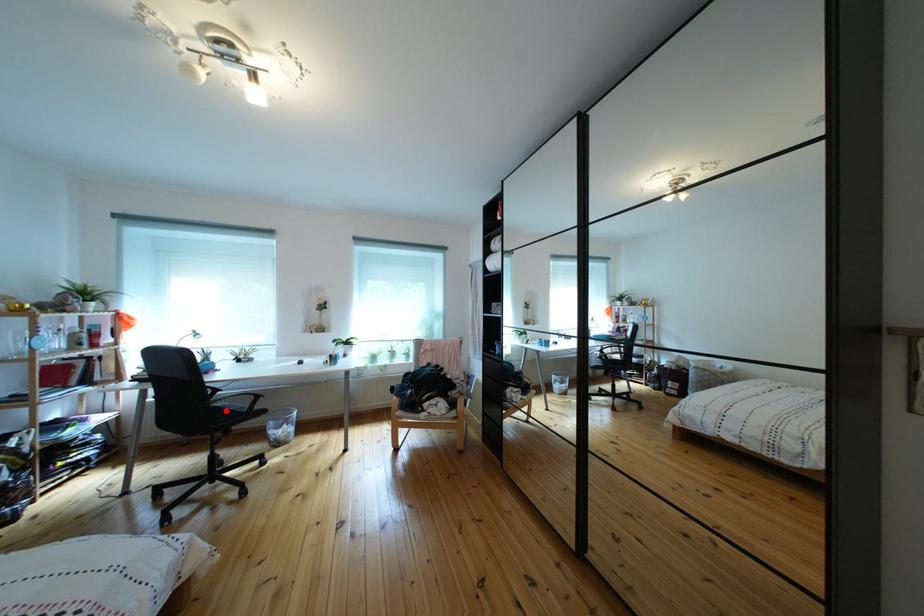
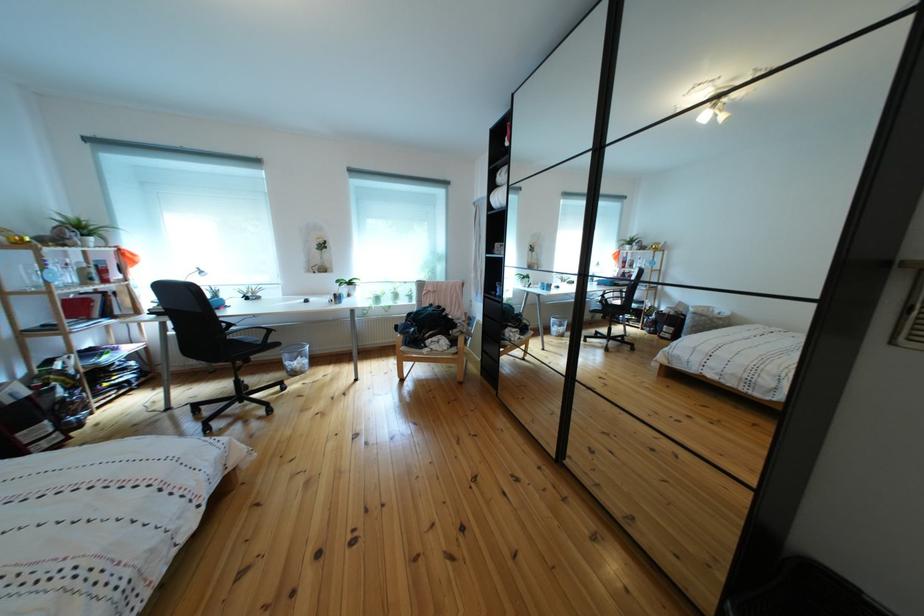
The point at the highlighted location is marked in the first image. Where is the corresponding point in the second image?

(241, 342)